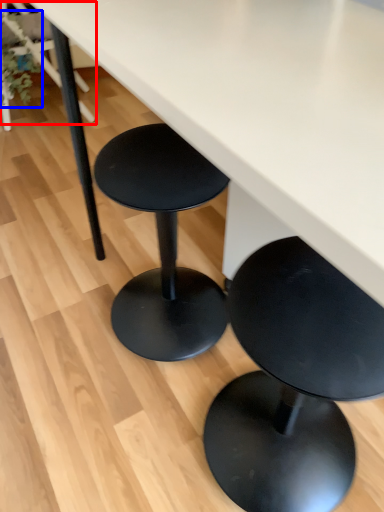
Question: Which object appears farthest to the camera in this image, chair (highlighted by a red box) or plant (highlighted by a blue box)?

Choices:
 (A) chair
 (B) plant

Answer: (A)